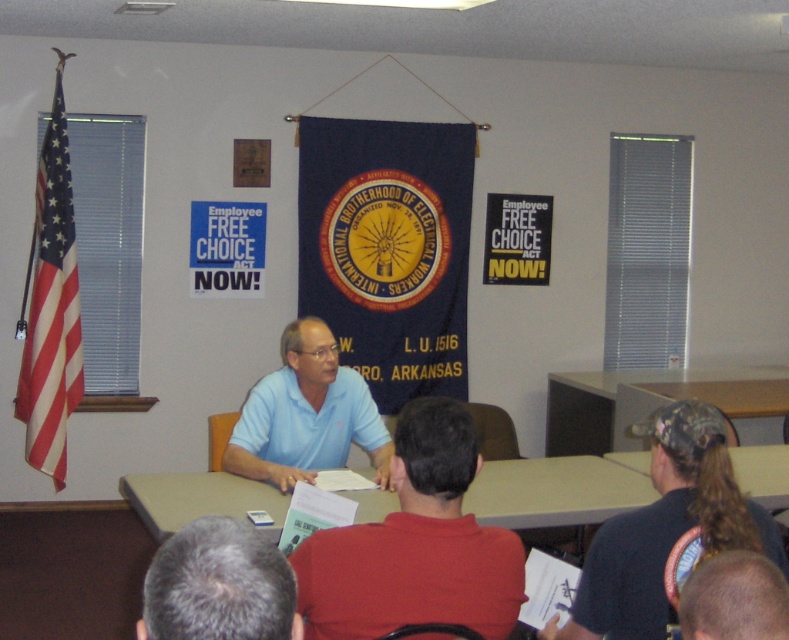
Is light gray plastic table at center above smooth bald head at lower right?

No, light gray plastic table at center is not above smooth bald head at lower right.

Locate an element on the screen. The width and height of the screenshot is (789, 640). light gray plastic table at center is located at coordinates (559, 490).

Can you confirm if light blue polo shirt at center is positioned below brown wood table at center?

Indeed, light blue polo shirt at center is positioned under brown wood table at center.

Image resolution: width=789 pixels, height=640 pixels. What are the coordinates of `light blue polo shirt at center` in the screenshot? It's located at (414, 545).

Who is more forward, (750, 520) or (249, 500)?

Positioned in front is point (750, 520).

At what (x,y) coordinates should I click in order to perform the action: click on black cap at center. Please return your answer as a coordinate pair (x, y). This screenshot has width=789, height=640. Looking at the image, I should click on (667, 529).